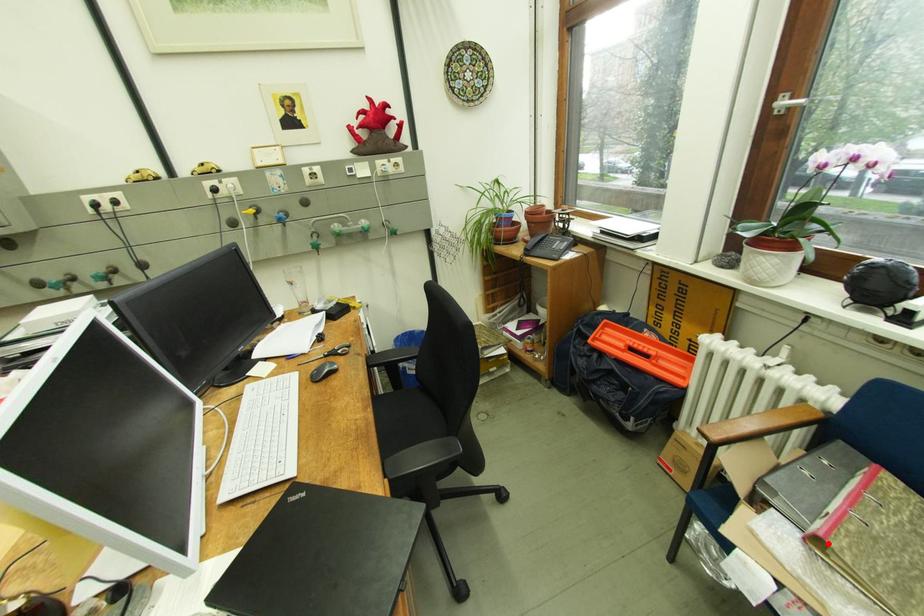
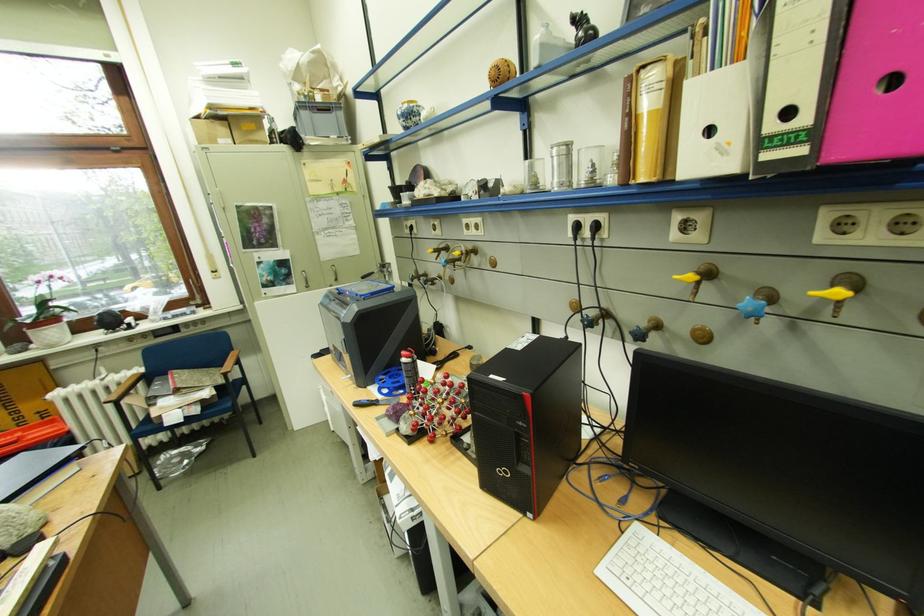
In the second image, find the point that corresponds to the highlighted location in the first image.

(187, 392)